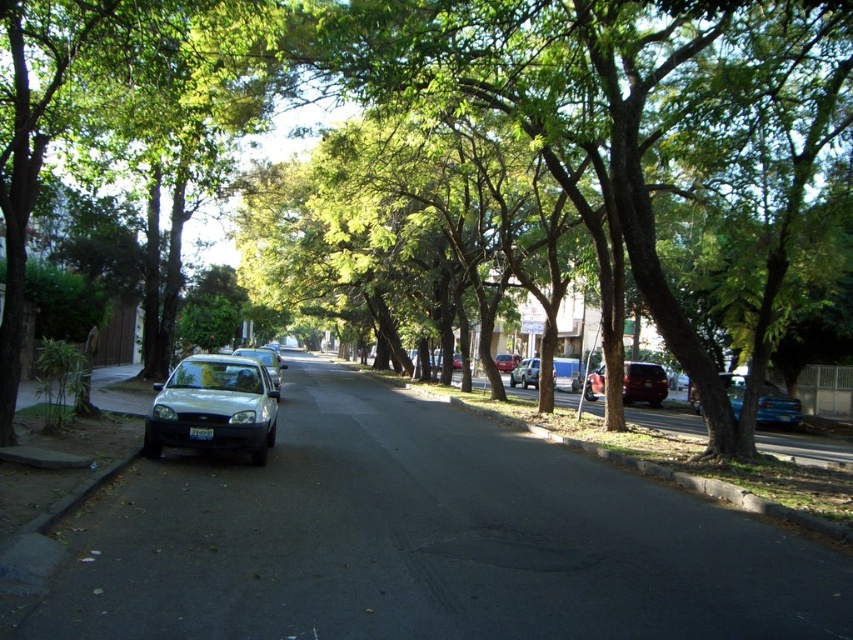
Who is more forward, (697, 403) or (257, 353)?

Positioned in front is point (257, 353).

Locate an element on the screen. The image size is (853, 640). metallic blue sedan at center is located at coordinates (776, 406).

From the picture: Does shiny red suv at right have a larger size compared to metallic red car at center?

Yes, shiny red suv at right is bigger than metallic red car at center.

Consider the image. Which is more to the right, shiny red suv at right or metallic red car at center?

Positioned to the right is metallic red car at center.

The width and height of the screenshot is (853, 640). Describe the element at coordinates (643, 384) in the screenshot. I see `shiny red suv at right` at that location.

The image size is (853, 640). Identify the location of shiny red suv at right. (643, 384).

Does point (693, 401) come farther from viewer compared to point (498, 364)?

No, it is in front of (498, 364).

Is metallic blue sedan at center wider than metallic red car at center?

Indeed, metallic blue sedan at center has a greater width compared to metallic red car at center.

Which is behind, point (733, 397) or point (496, 362)?

Point (496, 362)

At what (x,y) coordinates should I click in order to perform the action: click on metallic blue sedan at center. Please return your answer as a coordinate pair (x, y). Looking at the image, I should click on (776, 406).